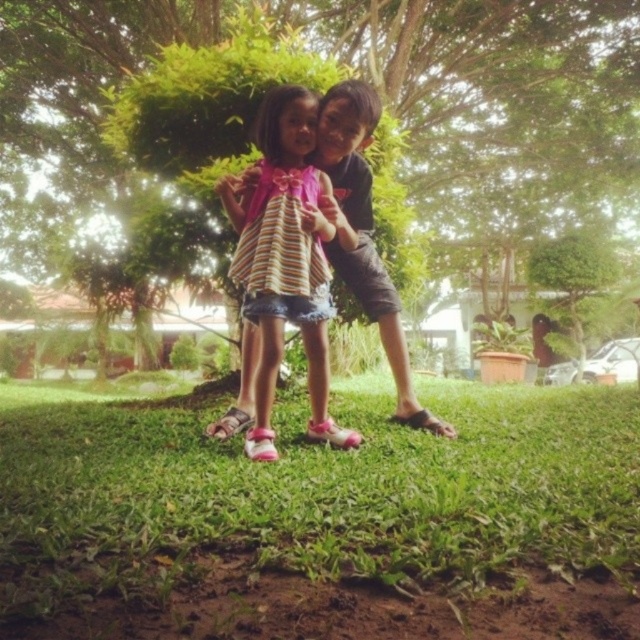
You are a photographer standing in front of the two children. You want to take a photo that includes both the green grass at lower center and the green leafy tree at center. Which object should you focus on first to ensure both are in focus?

You should focus on the green leafy tree at center first because it is farther away than the green grass at lower center, so focusing on the farther object will help both be in focus.

You are a photographer setting up a shot of the two children in the scene. You want to ensure the striped fabric dress at center is fully visible without being obscured by the green grass at lower center. Given their sizes, is this possible?

The green grass at lower center is wider than the striped fabric dress at center, so it may partially obscure the dress unless positioned carefully.

You are a photographer standing 10 feet away from the striped fabric dress at center. You want to take a photo of the green leafy tree at center without moving the children. Can you capture the entire tree in your frame without moving closer than 10 feet?

The distance between the green leafy tree at center and striped fabric dress at center is 19.56 feet. Since you are already 10 feet away from the dress, you are 9.56 feet away from the tree. To capture the entire tree without moving closer than 10 feet, you need to be at least 10 feet away from the tree. Therefore, you should move back an additional 0.44 feet to ensure the tree fits in the frame.